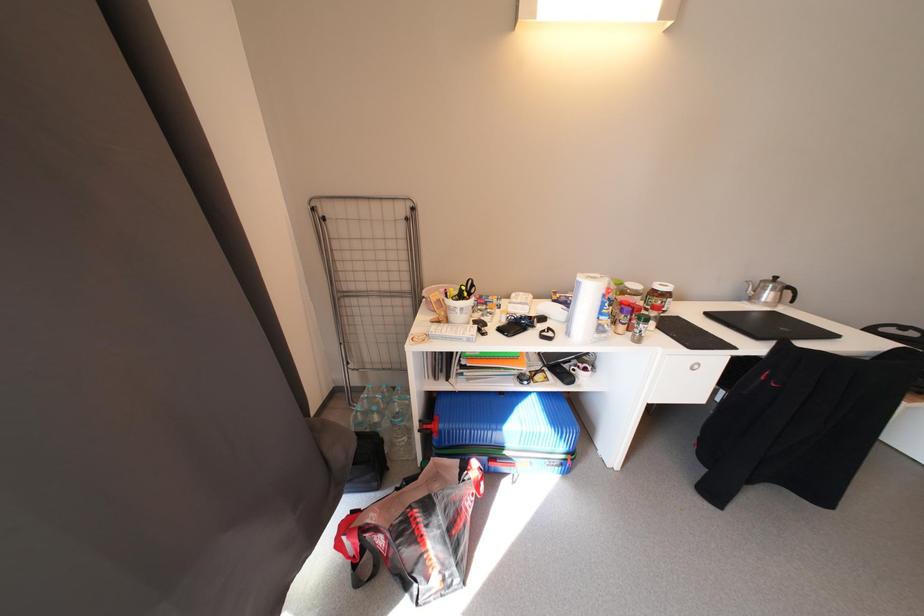
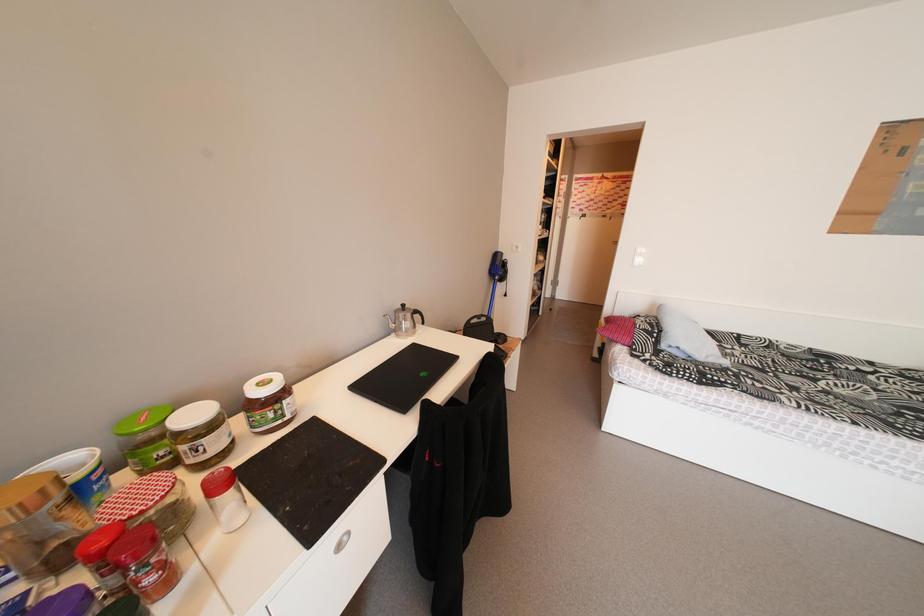
Question: How did the camera likely rotate?

Choices:
 (A) Left
 (B) Right
 (C) Up
 (D) Down

Answer: (B)